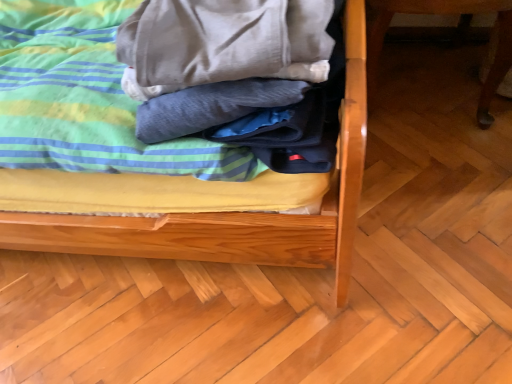
Question: Is wooden table leg at right inside or outside of soft cotton blanket at center?

Choices:
 (A) outside
 (B) inside

Answer: (A)

Question: Is wooden table leg at right bigger or smaller than soft cotton blanket at center?

Choices:
 (A) small
 (B) big

Answer: (B)

Question: Considering the real-world distances, which object is farthest from the wooden table leg at right?

Choices:
 (A) soft cotton bed at center
 (B) soft cotton blanket at center

Answer: (B)

Question: Which object is positioned farthest from the soft cotton bed at center?

Choices:
 (A) wooden table leg at right
 (B) soft cotton blanket at center

Answer: (A)